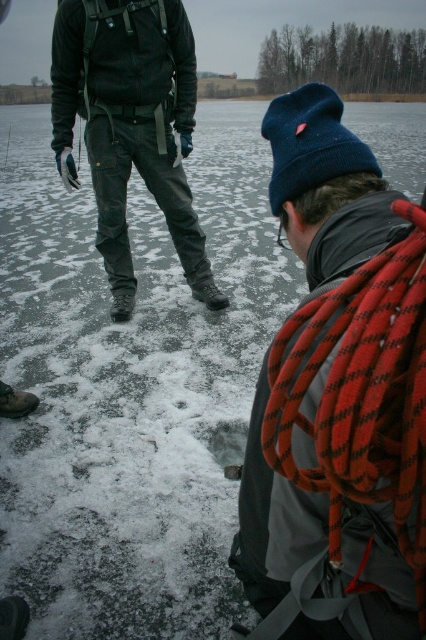
You are a safety inspector assessing the scene. You notice the red rope at center and the dark green pants at center. Which object is shorter in height?

The red rope at center is shorter in height compared to the dark green pants at center.

You are a winter hiker who wants to throw a red rope at center to the person wearing dark green pants at center. Can you reach them with the rope?

The red rope at center and dark green pants at center are 2.42 meters apart from each other. The red rope at center is 2.42 meters long, so yes, you can reach the person wearing dark green pants at center with the rope.

You are planning to place a small box on the frozen lake where the red rope at center and dark green pants at center are located. Which object should you place the box next to if you want it to be in a less crowded area?

You should place the box next to the red rope at center because it occupies less space than the dark green pants at center, making the area around it less crowded.